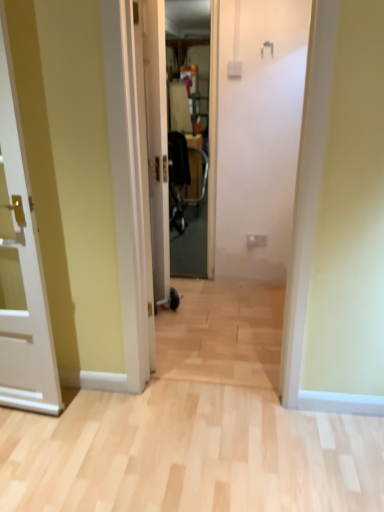
Identify the location of vacant area in front of white glossy door at left, the 1th door from the left. (36, 485).